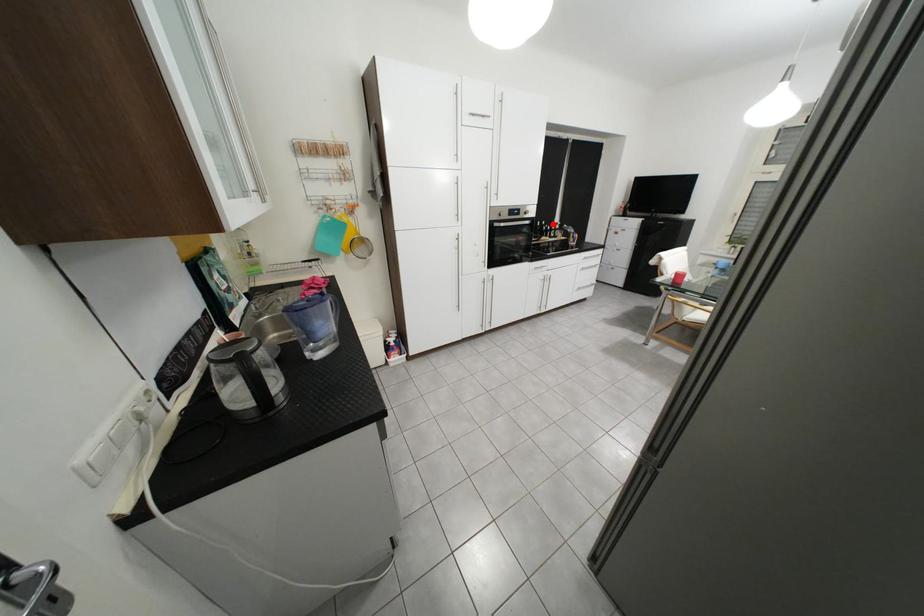
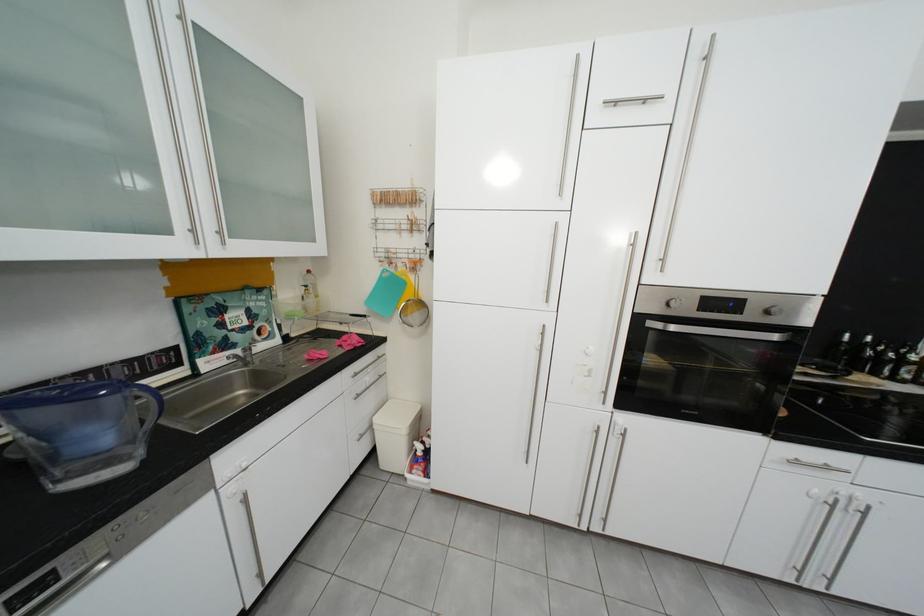
Question: I am providing you with two images of the same scene from different viewpoints. In image1, a red point is highlighted. Considering the same 3D point in image2, which of the following is correct?

Choices:
 (A) It is closer
 (B) It is farther

Answer: (B)